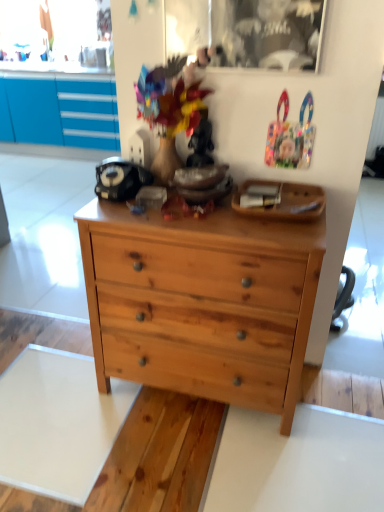
Identify the location of vacant space underneath wooden tray at upper center (from a real-world perspective). (284, 211).